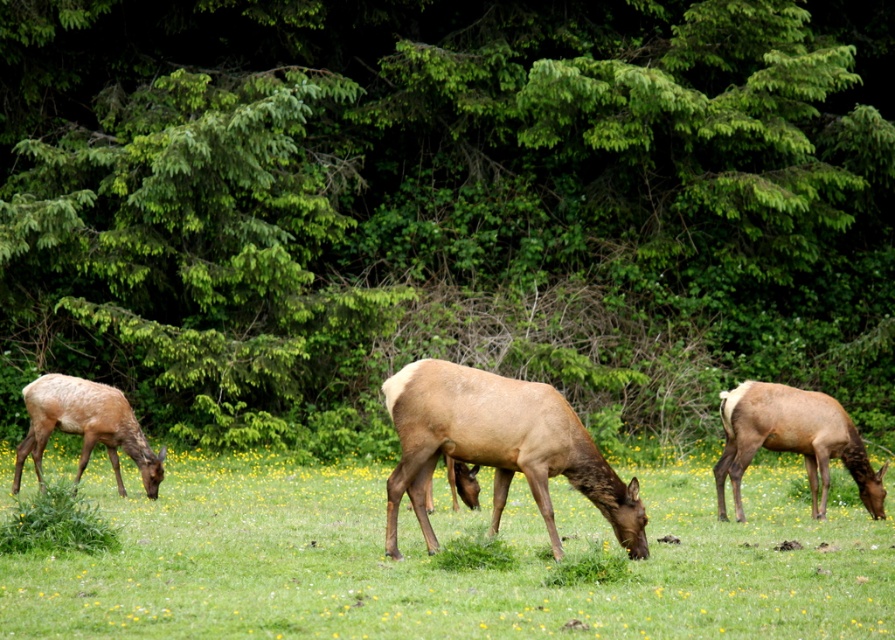
Question: Is brown matte/deer at center below brown velvet deer at right?

Choices:
 (A) yes
 (B) no

Answer: (B)

Question: Is brown velvet deer at right to the left of brown velvet deer at left from the viewer's perspective?

Choices:
 (A) no
 (B) yes

Answer: (A)

Question: Among these objects, which one is farthest from the camera?

Choices:
 (A) brown matte/deer at center
 (B) brown velvet deer at right

Answer: (B)

Question: Which object is positioned farthest from the green grass at center?

Choices:
 (A) green leafy tree at center
 (B) brown velvet deer at right
 (C) brown velvet deer at left

Answer: (A)

Question: Is green grass at center wider than brown velvet deer at right?

Choices:
 (A) yes
 (B) no

Answer: (A)

Question: Which point is farther to the camera?

Choices:
 (A) brown velvet deer at left
 (B) green grass at center

Answer: (A)